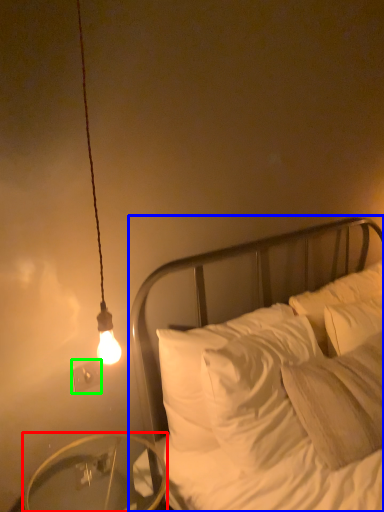
Question: Based on their relative distances, which object is farther from table (highlighted by a red box)? Choose from bed (highlighted by a blue box) and electric outlet (highlighted by a green box).

Choices:
 (A) bed
 (B) electric outlet

Answer: (A)